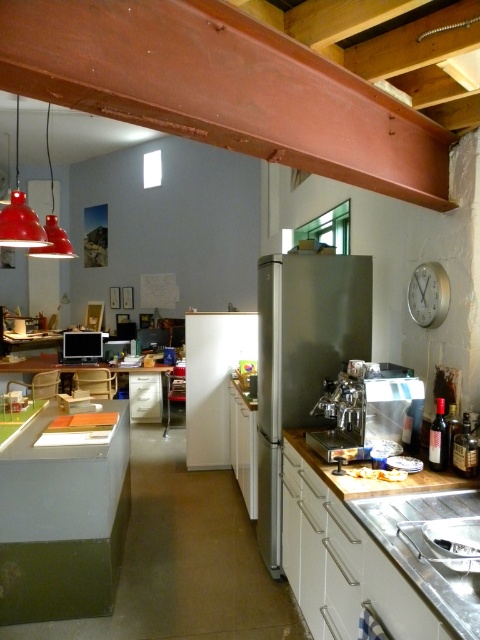
Question: Which object is the farthest from the matte red pendant light at upper left?

Choices:
 (A) stainless steel refrigerator at center
 (B) sleek metallic coffee machine at center

Answer: (B)

Question: Which of these objects is positioned closest to the brown wooden beam at upper center?

Choices:
 (A) silver metallic clock at upper right
 (B) sleek metallic coffee machine at center
 (C) matte red pendant light at upper left

Answer: (A)

Question: Can you confirm if brown wooden beam at upper center is positioned below sleek metallic coffee machine at center?

Choices:
 (A) no
 (B) yes

Answer: (A)

Question: Is silver metallic clock at upper right below matte red pendant light at upper left?

Choices:
 (A) yes
 (B) no

Answer: (A)

Question: Observing the image, what is the correct spatial positioning of sleek metallic coffee machine at center in reference to silver metallic clock at upper right?

Choices:
 (A) right
 (B) left

Answer: (B)

Question: Which object is farther from the camera taking this photo?

Choices:
 (A) silver metallic clock at upper right
 (B) sleek metallic coffee machine at center

Answer: (A)